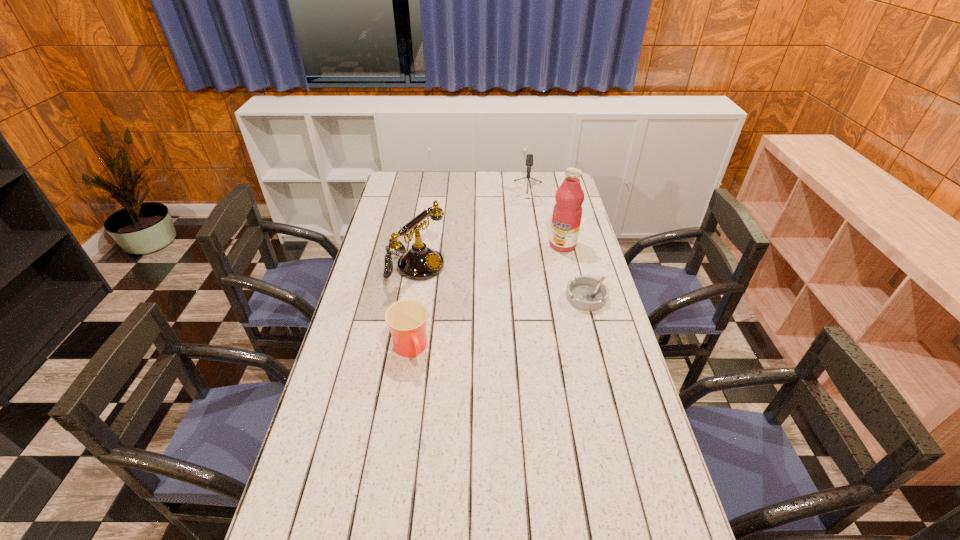
You are a GUI agent. You are given a task and a screenshot of the screen. Output one action in this format:
    pyautogui.click(x=<x>, y=<y>)
    Task: Click on the nearest object
    
    Given the screenshot: What is the action you would take?
    pyautogui.click(x=406, y=319)

Where is `ashtray`? This screenshot has height=540, width=960. ashtray is located at coordinates point(586,293).

This screenshot has width=960, height=540. Find the location of `the tallest object`. the tallest object is located at coordinates (567, 212).

At what (x,y) coordinates should I click in order to perform the action: click on telephone. Please return your answer as a coordinate pair (x, y). The width and height of the screenshot is (960, 540). Looking at the image, I should click on (419, 263).

What are the coordinates of `microphone` in the screenshot? It's located at 529,158.

This screenshot has width=960, height=540. I want to click on vacant area located on the back of the cup, so [x=418, y=304].

The height and width of the screenshot is (540, 960). I want to click on vacant space located 0.230m on the back of the shortest object, so tap(572, 246).

Locate an element on the screen. The height and width of the screenshot is (540, 960). free spot located 0.320m on the label of the tallest object is located at coordinates (513, 297).

Find the location of a particular element. This screenshot has width=960, height=540. free spot located on the label of the tallest object is located at coordinates pos(502,308).

The height and width of the screenshot is (540, 960). What are the coordinates of `vacant space located 0.220m on the label of the tallest object` in the screenshot? It's located at (528, 282).